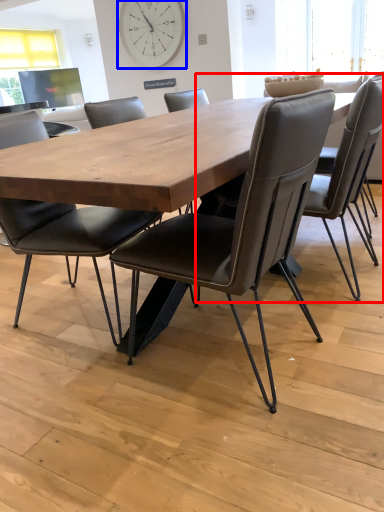
Question: Which object is closer to the camera taking this photo, chair (highlighted by a red box) or clock (highlighted by a blue box)?

Choices:
 (A) chair
 (B) clock

Answer: (A)